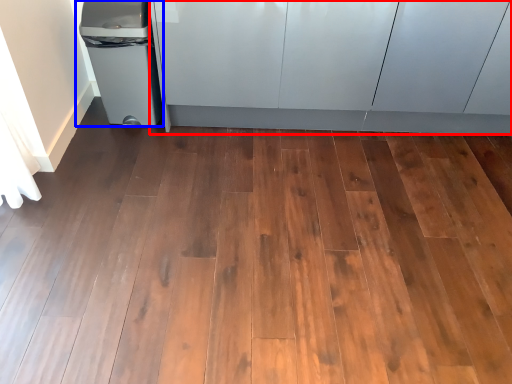
Question: Which point is closer to the camera, cabinetry (highlighted by a red box) or waste container (highlighted by a blue box)?

Choices:
 (A) cabinetry
 (B) waste container

Answer: (A)